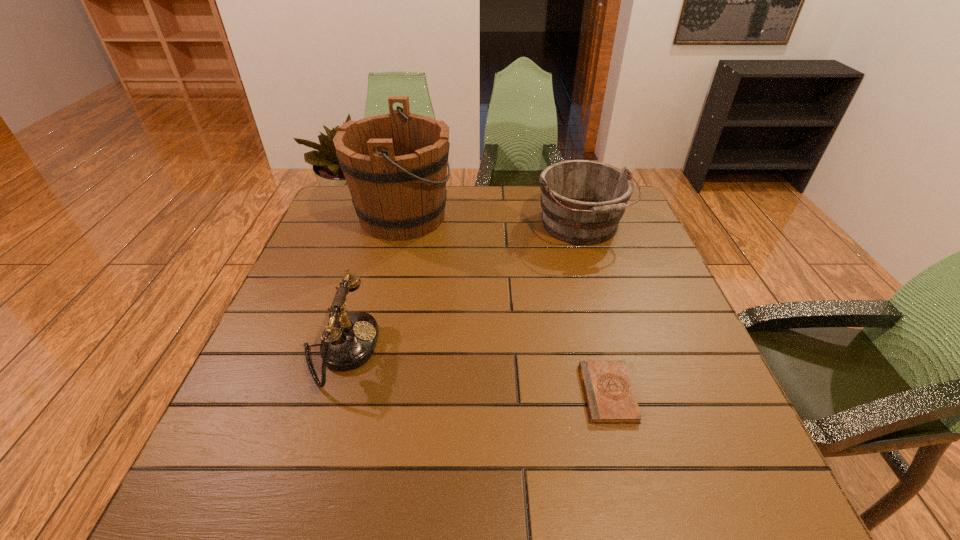
This screenshot has height=540, width=960. I want to click on vacant space located on the spine side of the diary, so click(528, 393).

Where is `wine bucket that is at the left edge`? The width and height of the screenshot is (960, 540). wine bucket that is at the left edge is located at coordinates (395, 165).

Locate an element on the screen. This screenshot has height=540, width=960. telephone located in the left edge section of the desktop is located at coordinates (349, 339).

Where is `object that is at the right edge`? The image size is (960, 540). object that is at the right edge is located at coordinates (582, 201).

This screenshot has width=960, height=540. Identify the location of object situated at the far left corner. [395, 165].

This screenshot has height=540, width=960. I want to click on object at the far right corner, so click(582, 201).

In the image, there is a desktop. Identify the location of free space at the far edge. (475, 206).

Where is `vacant space at the near edge`? This screenshot has width=960, height=540. vacant space at the near edge is located at coordinates (512, 465).

Locate an element on the screen. This screenshot has width=960, height=540. free region at the left edge is located at coordinates (243, 420).

Image resolution: width=960 pixels, height=540 pixels. Identify the location of vacant space at the right edge of the desktop. (618, 250).